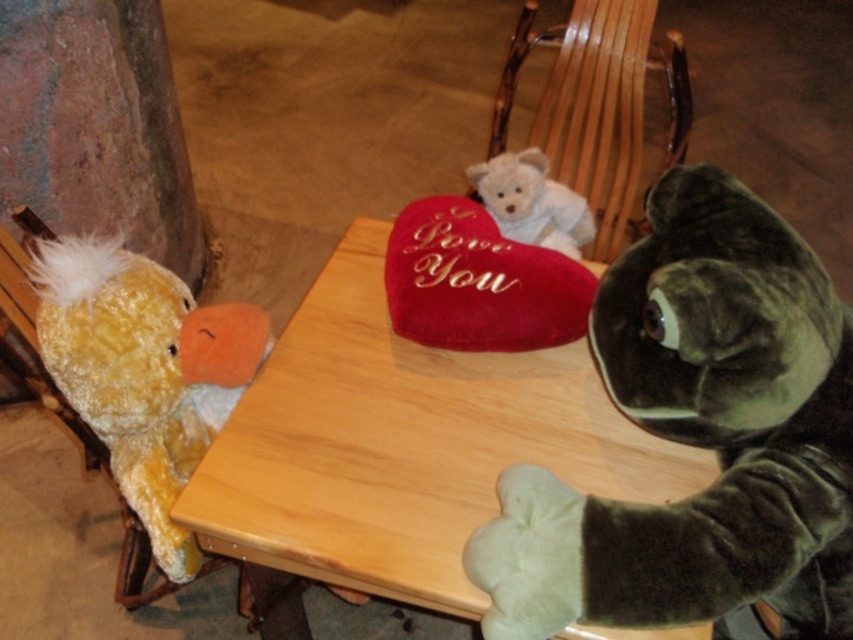
Question: Based on their relative distances, which object is farther from the fuzzy yellow duck at left?

Choices:
 (A) velvet green plush toy at right
 (B) wooden table at center

Answer: (A)

Question: Does fuzzy yellow duck at left have a smaller size compared to white plush teddy bear at upper center?

Choices:
 (A) no
 (B) yes

Answer: (A)

Question: Among these points, which one is farthest from the camera?

Choices:
 (A) (537, 403)
 (B) (549, 109)

Answer: (B)

Question: Is wooden rocking chair at center further to the viewer compared to white plush teddy bear at upper center?

Choices:
 (A) yes
 (B) no

Answer: (A)

Question: Among these points, which one is farthest from the camera?

Choices:
 (A) (358, 490)
 (B) (585, 243)

Answer: (B)

Question: Is fuzzy yellow duck at left above wooden rocking chair at center?

Choices:
 (A) no
 (B) yes

Answer: (A)